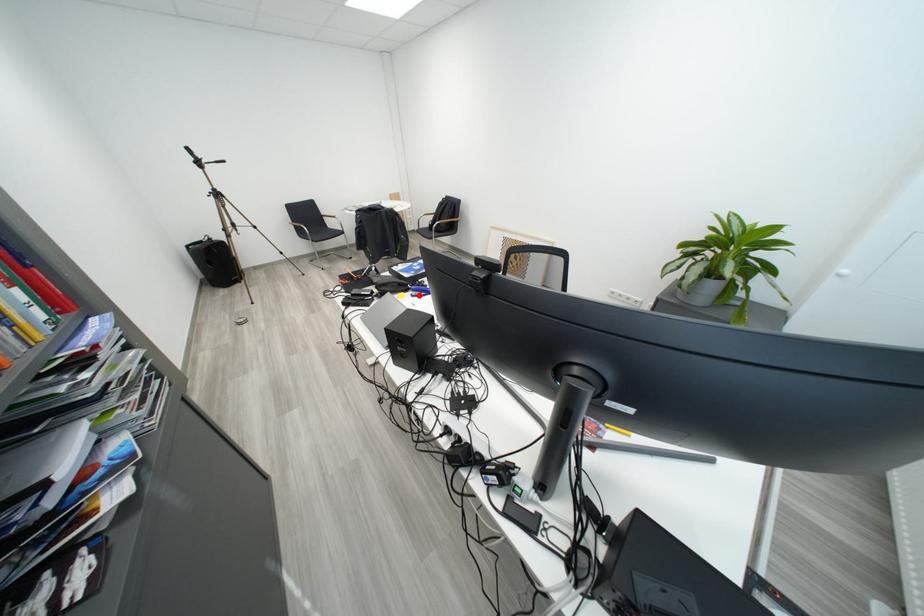
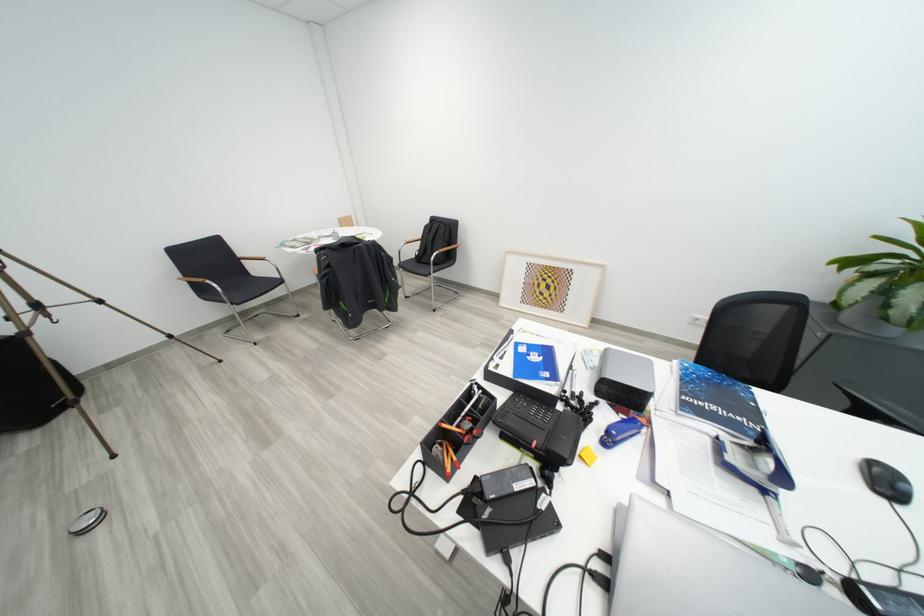
The point at the highlighted location is marked in the first image. Where is the corresponding point in the second image?

(600, 438)